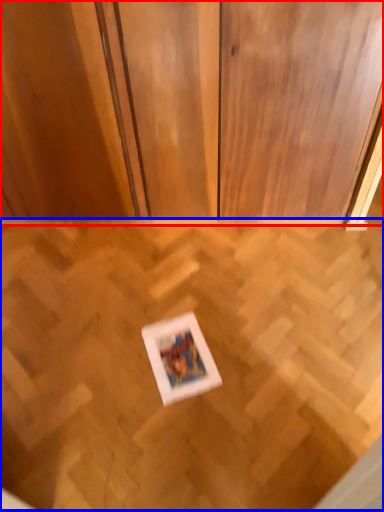
Question: Among these objects, which one is nearest to the camera, dresser (highlighted by a red box) or plywood (highlighted by a blue box)?

Choices:
 (A) dresser
 (B) plywood

Answer: (B)